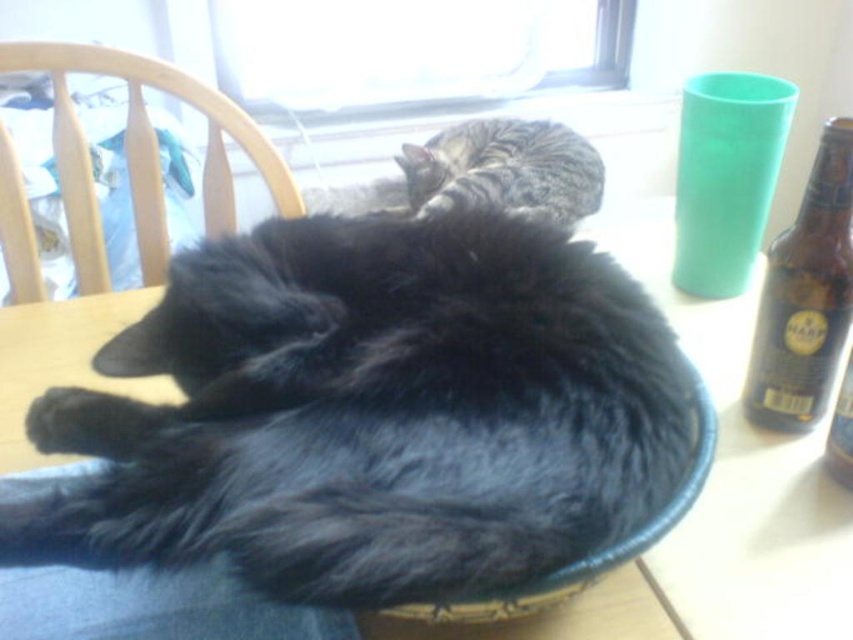
Is point (207, 173) positioned behind point (848, 275)?

Yes, point (207, 173) is farther from viewer.

Is wooden chair at upper left to the right of brown glass bottle at right from the viewer's perspective?

No, wooden chair at upper left is not to the right of brown glass bottle at right.

Is point (268, 147) closer to camera compared to point (810, 332)?

That is False.

What are the coordinates of `wooden chair at upper left` in the screenshot? It's located at (143, 154).

In the scene shown: Can you confirm if black fluffy cat at center is smaller than wooden chair at upper left?

No.

Image resolution: width=853 pixels, height=640 pixels. What do you see at coordinates (372, 413) in the screenshot?
I see `black fluffy cat at center` at bounding box center [372, 413].

Image resolution: width=853 pixels, height=640 pixels. Find the location of `black fluffy cat at center`. black fluffy cat at center is located at coordinates (372, 413).

Does brown glass bottle at right have a lesser width compared to tabby fur cat at upper center?

Correct, brown glass bottle at right's width is less than tabby fur cat at upper center's.

Measure the distance between point (828, 214) and camera.

The distance of point (828, 214) from camera is 24.43 inches.

I want to click on brown glass bottle at right, so click(805, 296).

Identify the location of brown glass bottle at right. This screenshot has width=853, height=640. (805, 296).